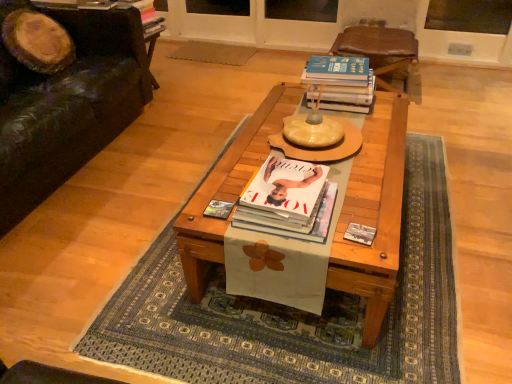
Where is `free space in front of gray matte paperback book at center`? free space in front of gray matte paperback book at center is located at coordinates (368, 258).